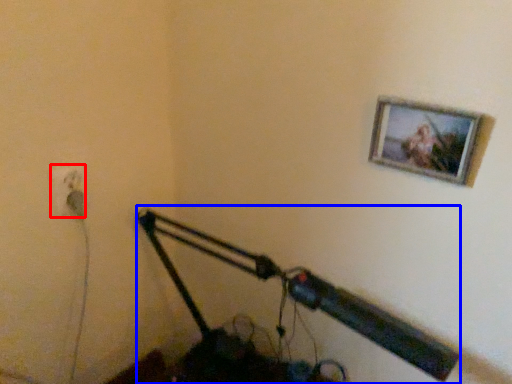
Question: Which point is closer to the camera, electric outlet (highlighted by a red box) or lamp (highlighted by a blue box)?

Choices:
 (A) electric outlet
 (B) lamp

Answer: (B)